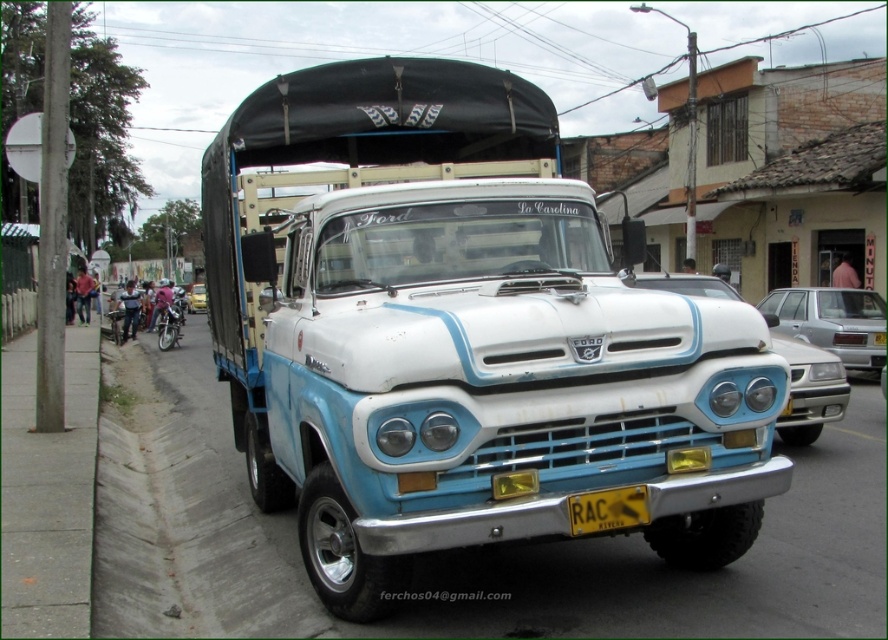
Question: Which of the following is the closest to the observer?

Choices:
 (A) blue matte truck at center
 (B) silver metallic sedan at right
 (C) yellow matte license plate at center
 (D) white glossy truck at center

Answer: (C)

Question: Which point appears farthest from the camera in this image?

Choices:
 (A) (201, 296)
 (B) (807, 317)
 (C) (612, 502)

Answer: (A)

Question: Observing the image, what is the correct spatial positioning of shiny silver motorcycle at left in reference to metallic silver car at center?

Choices:
 (A) left
 (B) right

Answer: (B)

Question: Can you confirm if silver metallic sedan at right is wider than metallic silver car at center?

Choices:
 (A) yes
 (B) no

Answer: (B)

Question: Which object appears farthest from the camera in this image?

Choices:
 (A) metallic silver car at center
 (B) shiny silver motorcycle at left
 (C) yellow matte license plate at center
 (D) white glossy truck at center

Answer: (A)

Question: Can you confirm if white glossy truck at center is positioned below shiny silver motorcycle at left?

Choices:
 (A) yes
 (B) no

Answer: (B)